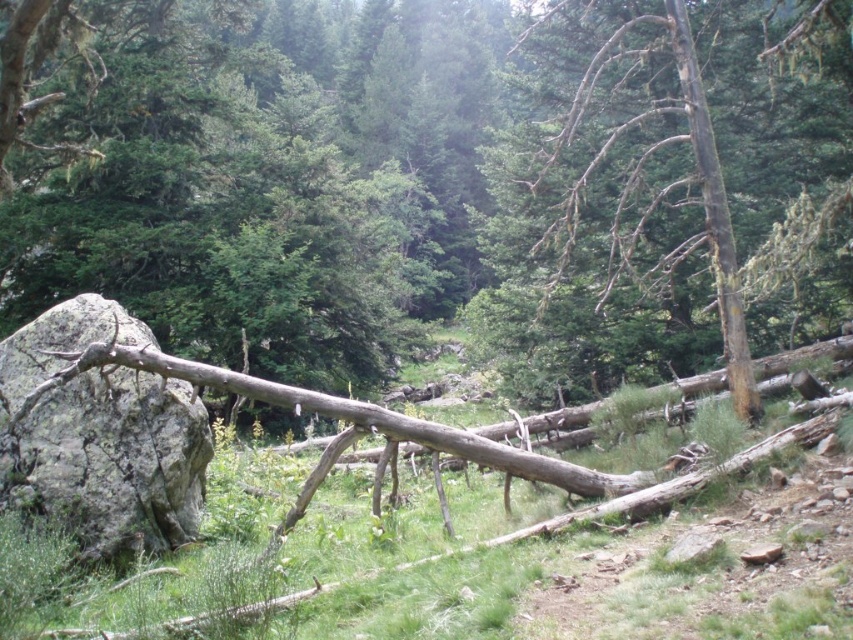
Question: Which of the following is the closest to the observer?

Choices:
 (A) (90, 186)
 (B) (735, 396)
 (C) (78, 416)

Answer: (C)

Question: Is charcoal gray bark tree at right below brown rough bark tree trunk at right?

Choices:
 (A) no
 (B) yes

Answer: (A)

Question: Which of the following is the closest to the observer?

Choices:
 (A) (308, 51)
 (B) (738, 300)

Answer: (B)

Question: In this image, where is charcoal gray bark tree at right located relative to gray rough boulder at left?

Choices:
 (A) above
 (B) below

Answer: (A)

Question: Estimate the real-world distances between objects in this image. Which object is farther from the brown rough tree trunk at center?

Choices:
 (A) charcoal gray bark tree at right
 (B) brown rough bark tree trunk at right

Answer: (B)

Question: Is gray rough boulder at left positioned at the back of brown rough bark tree trunk at right?

Choices:
 (A) no
 (B) yes

Answer: (A)